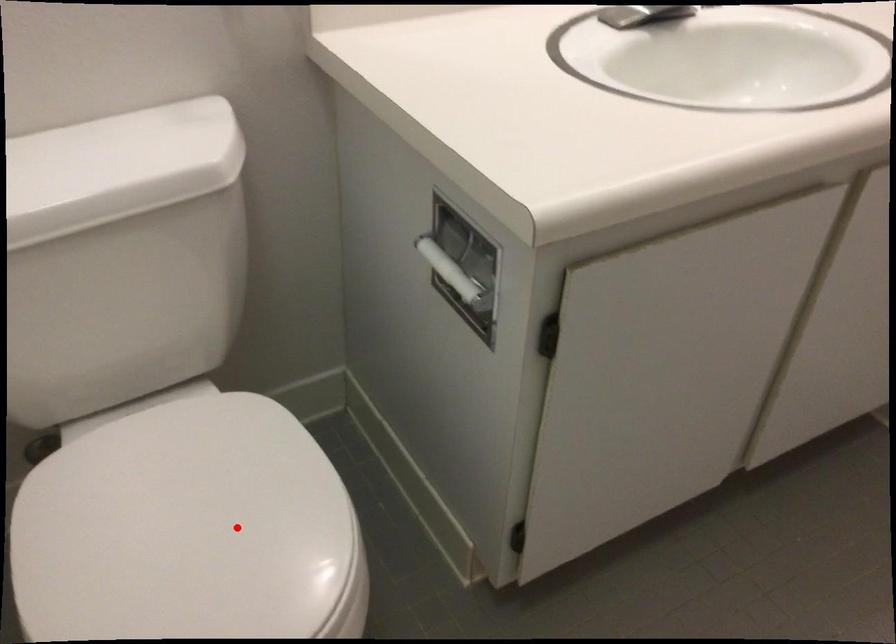
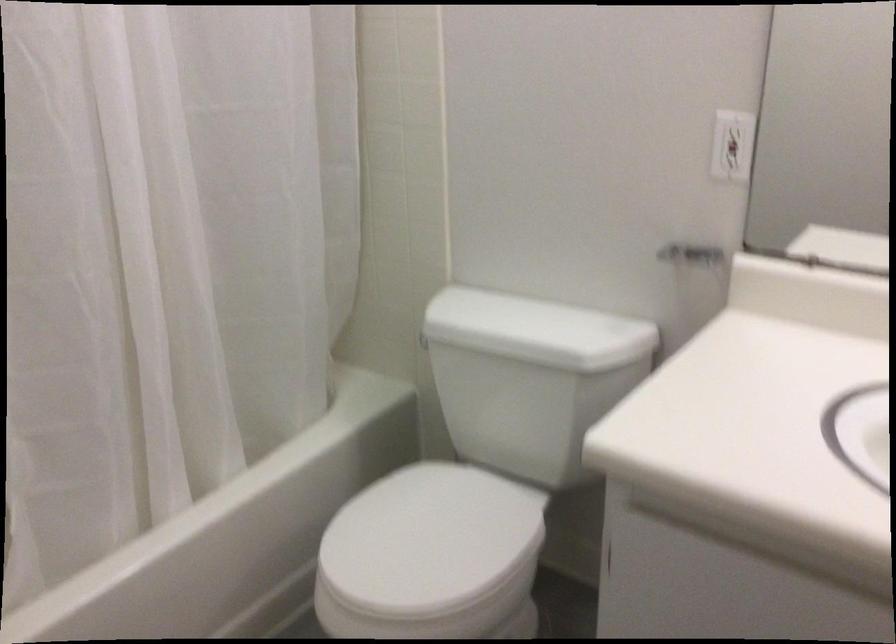
Question: I am providing you with two images of the same scene from different viewpoints. Given a red point in image1, look at the same physical point in image2. Is it:

Choices:
 (A) Closer to the viewpoint
 (B) Farther from the viewpoint

Answer: (B)